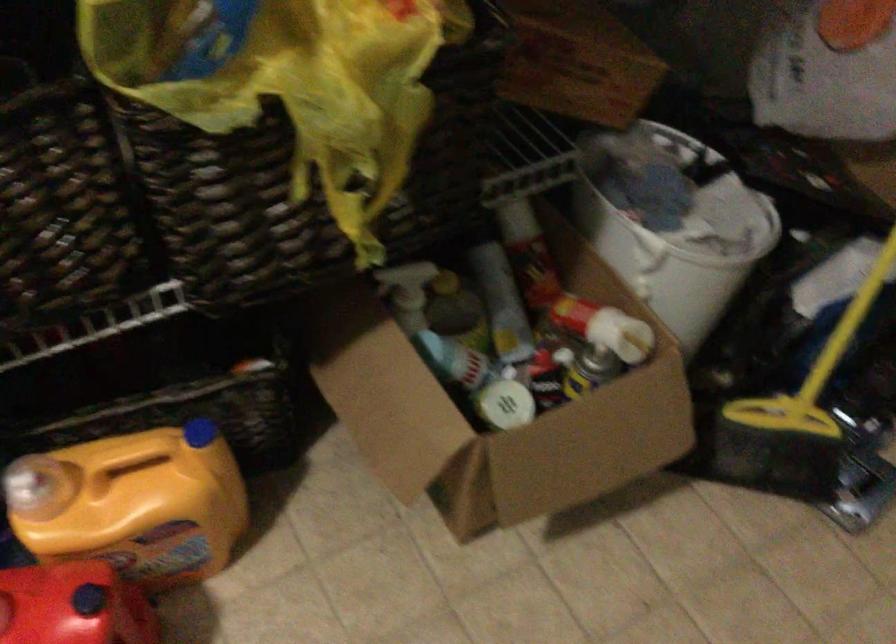
Image resolution: width=896 pixels, height=644 pixels. In order to click on white jar lid in this screenshot , I will do `click(595, 319)`.